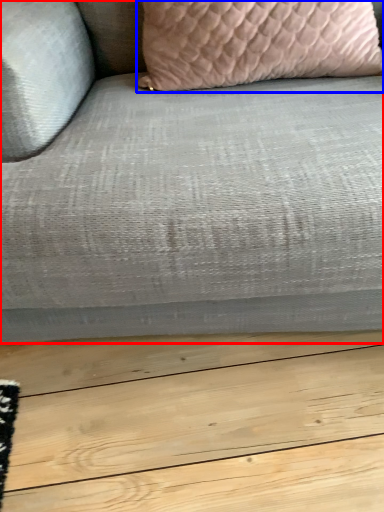
Question: Among these objects, which one is farthest to the camera, studio couch (highlighted by a red box) or pillow (highlighted by a blue box)?

Choices:
 (A) studio couch
 (B) pillow

Answer: (B)